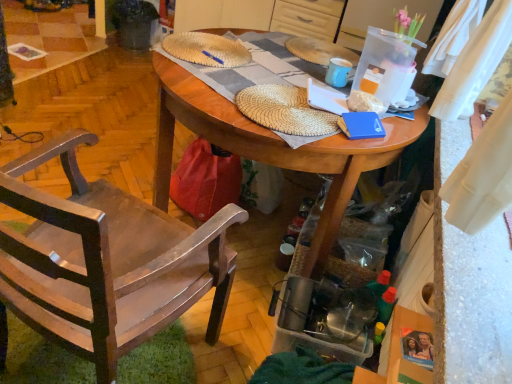
Find the location of a particular element. vacant region to the right of blue plastic pen at center is located at coordinates (248, 62).